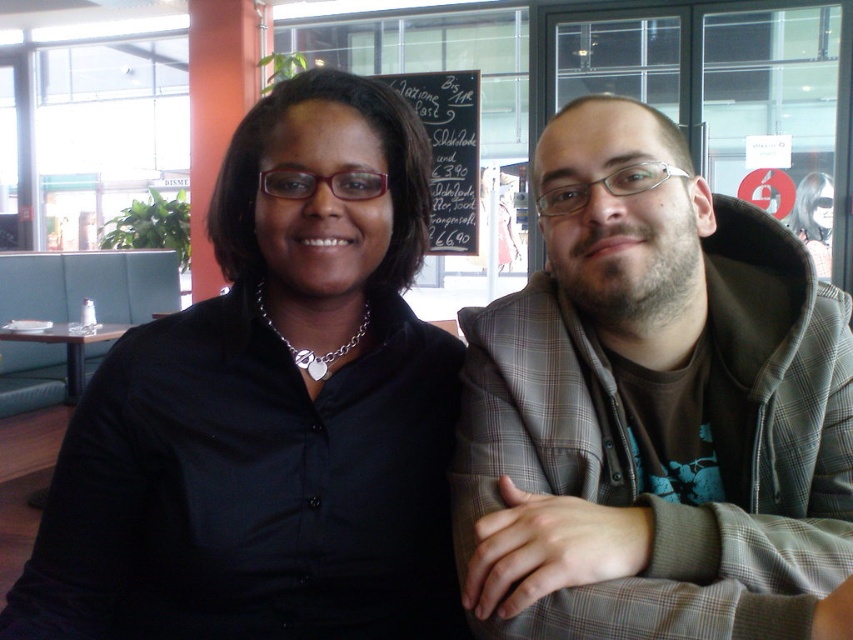
Which is more to the right, black shirt at center or brown plaid jacket at center?

brown plaid jacket at center

Which of these two, black shirt at center or brown plaid jacket at center, stands taller?

With more height is black shirt at center.

What do you see at coordinates (271, 410) in the screenshot? I see `black shirt at center` at bounding box center [271, 410].

Where is `black shirt at center`? The height and width of the screenshot is (640, 853). black shirt at center is located at coordinates (271, 410).

Looking at this image, does brown plaid jacket at center come in front of black chalkboard at upper center?

Yes, it is in front of black chalkboard at upper center.

Does point (669, 550) lie behind point (471, 112)?

No, (669, 550) is closer to viewer.

Which is behind, point (830, 328) or point (469, 147)?

The point (469, 147) is more distant.

Identify the location of brown plaid jacket at center. This screenshot has height=640, width=853. (653, 408).

Does black shirt at center have a lesser width compared to wooden table at left?

Correct, black shirt at center's width is less than wooden table at left's.

Does black shirt at center appear on the right side of wooden table at left?

Yes, black shirt at center is to the right of wooden table at left.

Locate an element on the screen. Image resolution: width=853 pixels, height=640 pixels. black shirt at center is located at coordinates click(x=271, y=410).